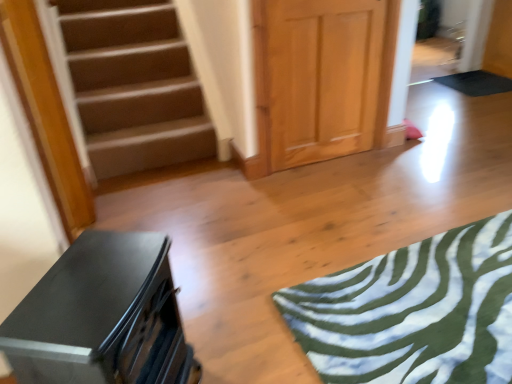
Find the location of a particular element. vacant region to the left of green fabric yoga mat at lower right, which is the second yoga mat in back-to-front order is located at coordinates (253, 261).